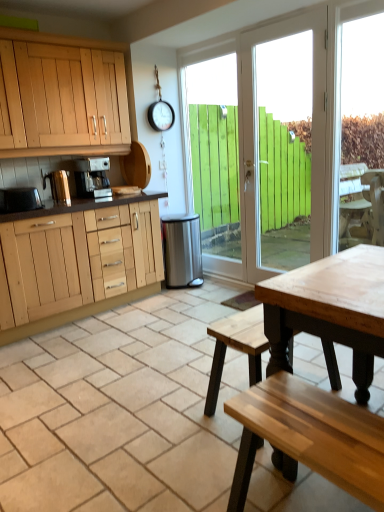
The width and height of the screenshot is (384, 512). I want to click on unoccupied area in front of stainless steel trash can at center, which ranks as the first appliance in back-to-front order, so click(x=190, y=294).